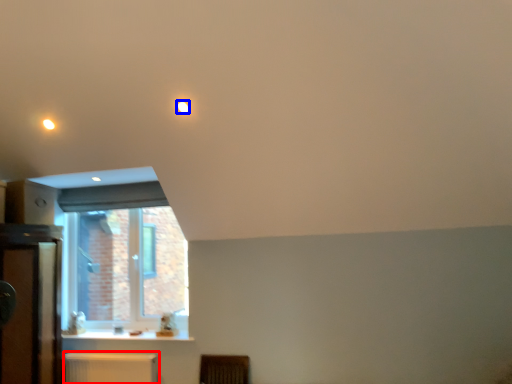
Question: Which point is further to the camera, radiator (highlighted by a red box) or lighting (highlighted by a blue box)?

Choices:
 (A) radiator
 (B) lighting

Answer: (A)